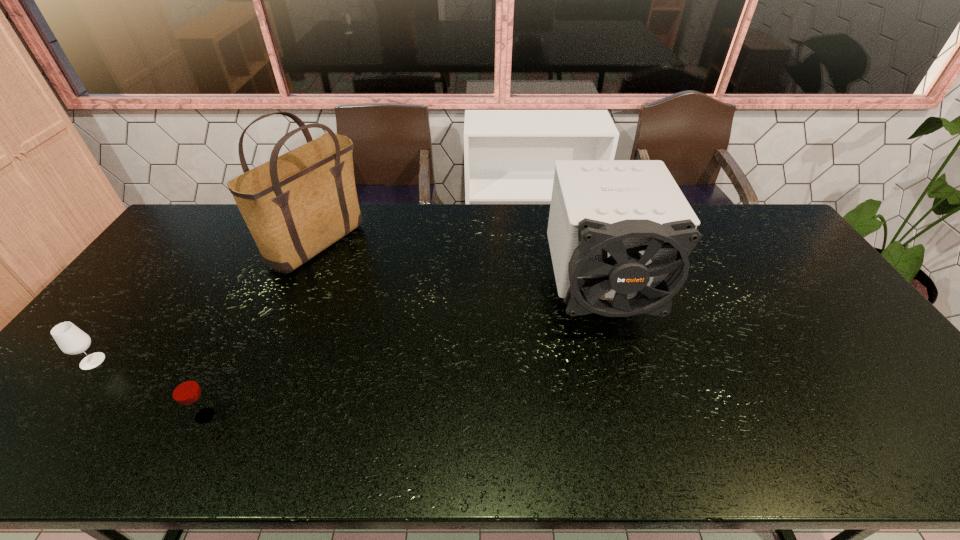
This screenshot has height=540, width=960. What are the coordinates of `free space located 0.180m on the right of the farther glass` in the screenshot? It's located at (174, 361).

Locate an element on the screen. Image resolution: width=960 pixels, height=540 pixels. object positioned at the far edge is located at coordinates (296, 205).

Find the location of a particular element. The height and width of the screenshot is (540, 960). object present at the near edge is located at coordinates (184, 389).

You are a GUI agent. You are given a task and a screenshot of the screen. Output one action in this format:
    pyautogui.click(x=<x>, y=<y>)
    Task: Click on the object that is at the left edge
    Image resolution: width=960 pixels, height=540 pixels.
    Given the screenshot: What is the action you would take?
    pyautogui.click(x=71, y=340)

Where is `free space at the far edge`? The height and width of the screenshot is (540, 960). free space at the far edge is located at coordinates (479, 229).

In the image, there is a desktop. Where is `vacant space at the near edge`? This screenshot has width=960, height=540. vacant space at the near edge is located at coordinates (295, 462).

Where is `vacant point at the left edge`? vacant point at the left edge is located at coordinates (61, 394).

Identify the location of vacant area at the right edge of the desktop. Image resolution: width=960 pixels, height=540 pixels. (789, 282).

Where is `free space at the far left corner`? Image resolution: width=960 pixels, height=540 pixels. free space at the far left corner is located at coordinates (215, 243).

This screenshot has height=540, width=960. Identify the location of vacant area at the near right corner of the desktop. (946, 446).